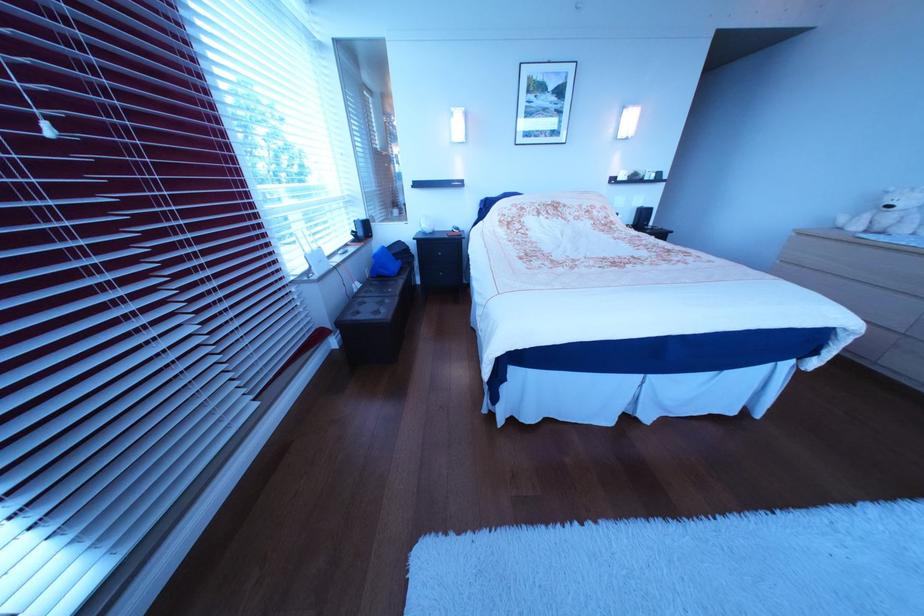
What do you see at coordinates (447, 235) in the screenshot? I see `the dresser drawer edge` at bounding box center [447, 235].